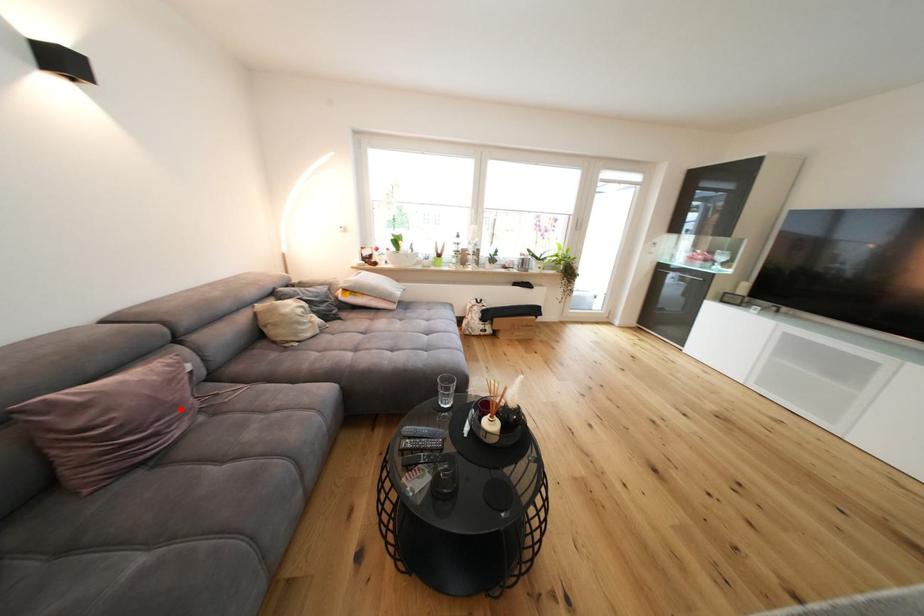
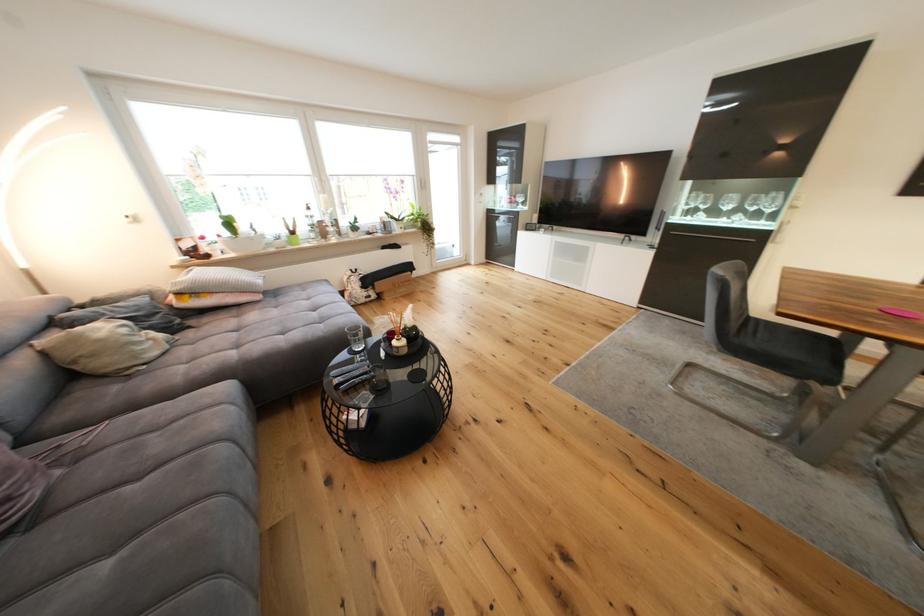
Locate, in the second image, the point that corresponds to the highlighted location in the first image.

(18, 469)